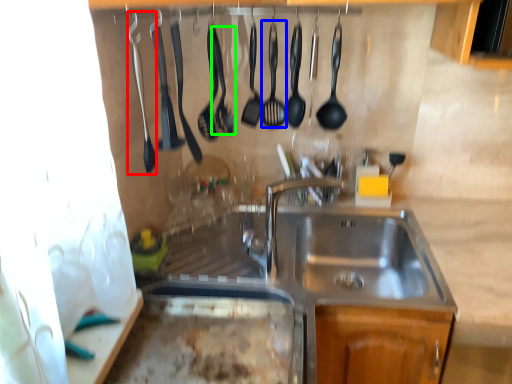
Question: Based on their relative distances, which object is farther from silverware (highlighted by a red box)? Choose from utensil (highlighted by a blue box) and utensil (highlighted by a green box).

Choices:
 (A) utensil
 (B) utensil

Answer: (A)